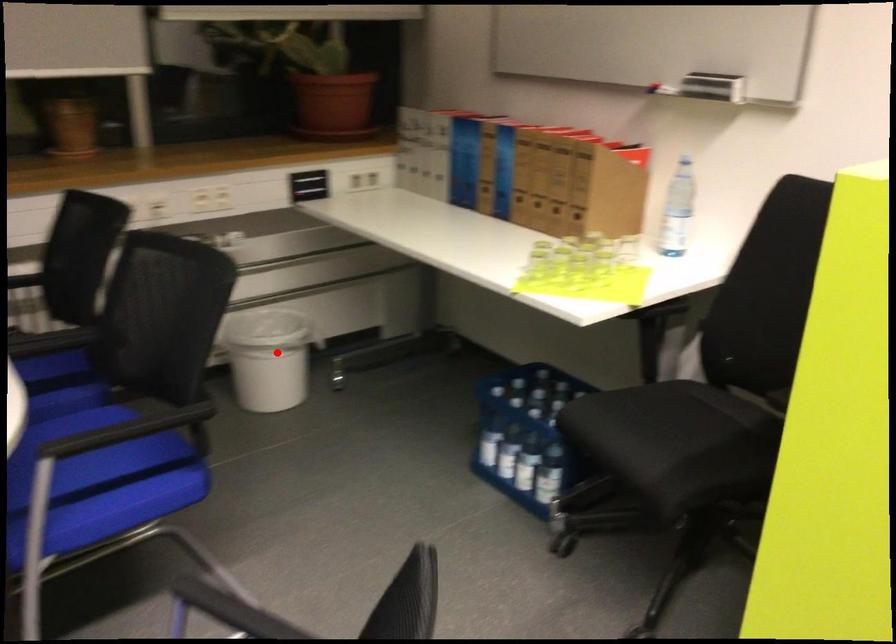
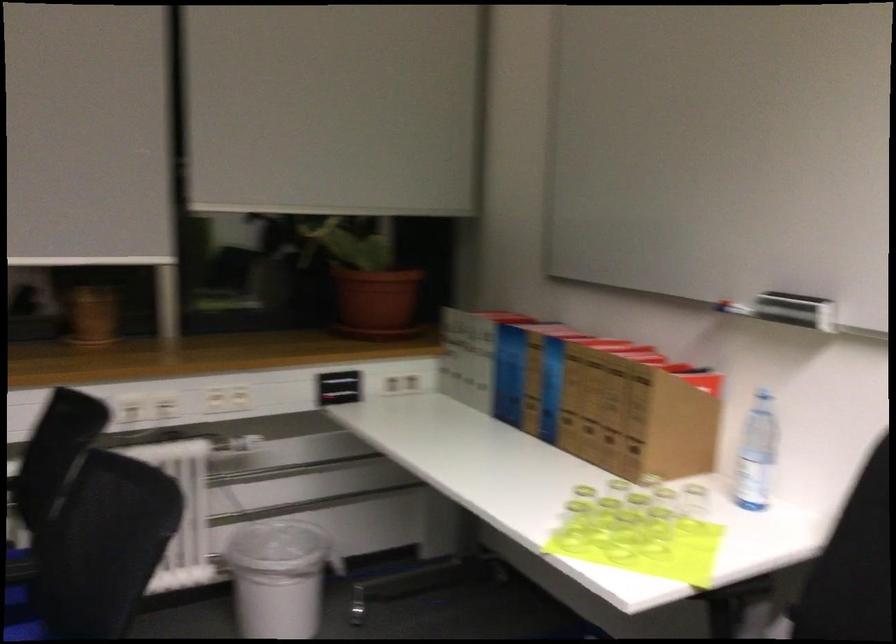
Question: A red point is marked in image1. In image2, is the corresponding 3D point closer to the camera or farther? Reply with the corresponding letter.

Choices:
 (A) The corresponding 3D point is closer.
 (B) The corresponding 3D point is farther.

Answer: (A)